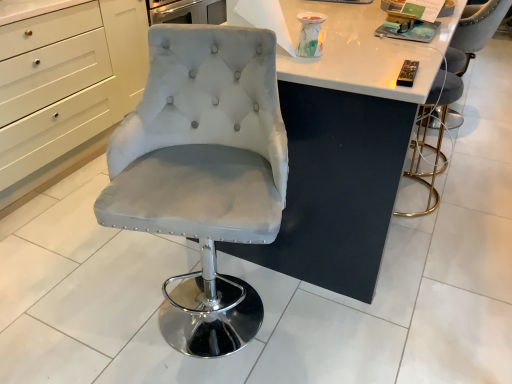
Find the location of `empty space that is to the right of velvet grey chair at right, acting as the third chair starting from the left`. empty space that is to the right of velvet grey chair at right, acting as the third chair starting from the left is located at coordinates (492, 117).